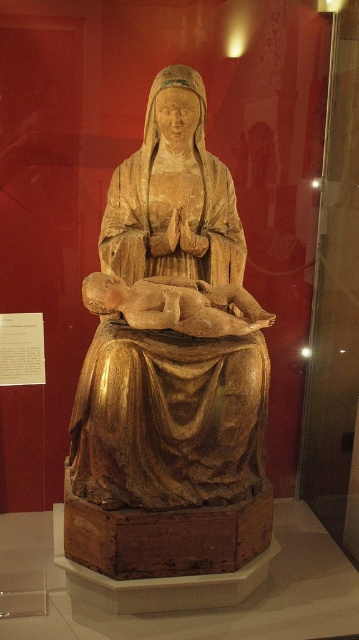
Question: Estimate the real-world distances between objects in this image. Which object is farther from the golden polished wood statue at center?

Choices:
 (A) golden wood statue at center
 (B) matte wood baby at center

Answer: (B)

Question: Which of these objects is positioned farthest from the golden wood statue at center?

Choices:
 (A) matte wood baby at center
 (B) golden polished wood statue at center

Answer: (A)

Question: Does golden polished wood statue at center appear over golden wood statue at center?

Choices:
 (A) yes
 (B) no

Answer: (B)

Question: Is golden polished wood statue at center wider than matte wood baby at center?

Choices:
 (A) yes
 (B) no

Answer: (A)

Question: Which point appears closest to the camera in this image?

Choices:
 (A) (174, 561)
 (B) (156, 131)

Answer: (A)

Question: Can you confirm if golden wood statue at center is positioned below matte wood baby at center?

Choices:
 (A) no
 (B) yes

Answer: (A)